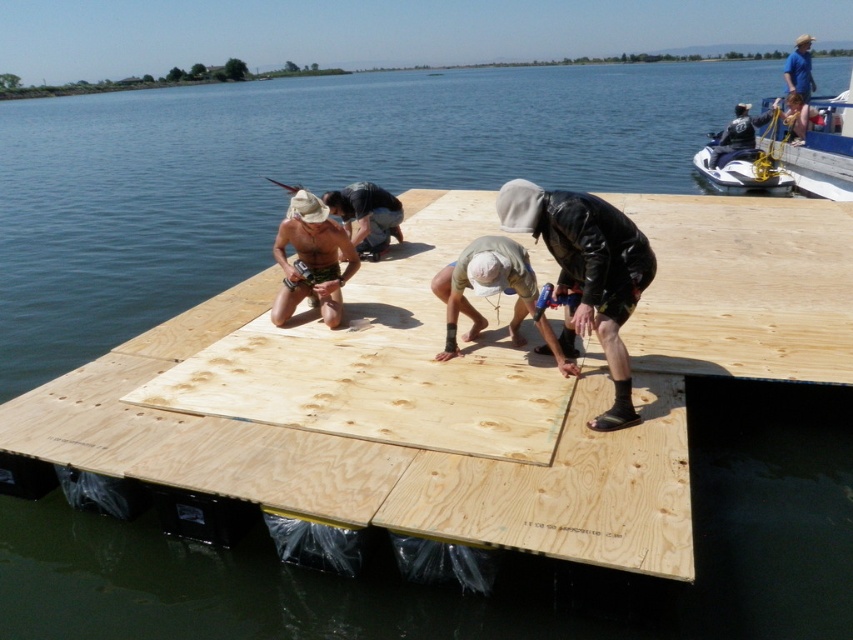
Question: Which of the following is the closest to the observer?

Choices:
 (A) black leather jacket at center
 (B) tan skin shirtless man at center
 (C) blue leather jacket at upper right

Answer: (A)

Question: Estimate the real-world distances between objects in this image. Which object is closer to the tan skin shirtless man at center?

Choices:
 (A) dark blue wetsuit at upper right
 (B) matte black shirt at center

Answer: (B)

Question: Which object is farther from the camera taking this photo?

Choices:
 (A) black leather jacket at center
 (B) blue denim shorts at upper right

Answer: (B)

Question: Considering the relative positions of black leather jacket at center and light brown wood at center in the image provided, where is black leather jacket at center located with respect to light brown wood at center?

Choices:
 (A) above
 (B) below

Answer: (A)

Question: Considering the relative positions of metallic blue jet ski at upper right and matte black shirt at center in the image provided, where is metallic blue jet ski at upper right located with respect to matte black shirt at center?

Choices:
 (A) right
 (B) left

Answer: (A)

Question: Can you confirm if black leather jacket at center is wider than tan skin shirtless man at center?

Choices:
 (A) no
 (B) yes

Answer: (B)